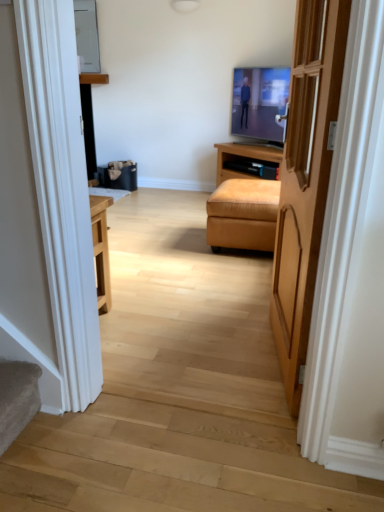
In order to click on blank area to the left of suede-like tan ottoman at center in this screenshot , I will do `click(175, 241)`.